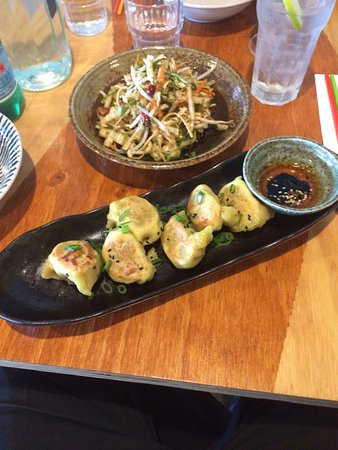
What are the coordinates of `white bowl on table` in the screenshot? It's located at 209,14.